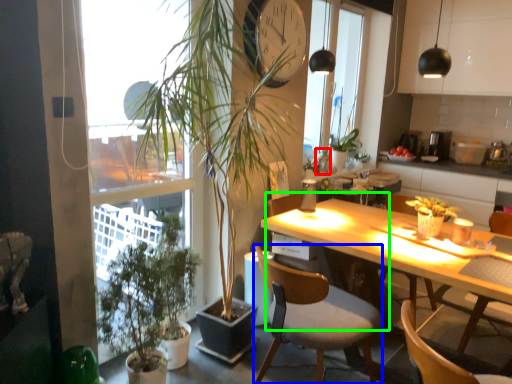
Question: Which object is positioned closest to bottle (highlighted by a red box)? Select from chair (highlighted by a blue box) and chair (highlighted by a green box).

Choices:
 (A) chair
 (B) chair

Answer: (B)